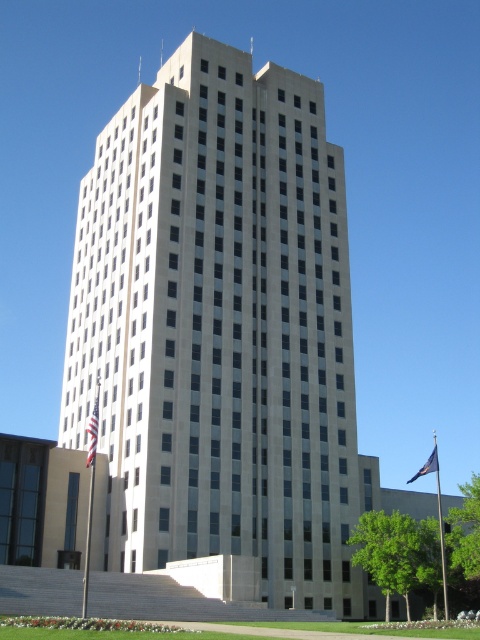
Question: Which is farther from the blue fabric flag at lower right?

Choices:
 (A) metallic flag pole at left
 (B) metallic flag pole at lower right
 (C) american flag at left
 (D) beige concrete tower at center

Answer: (C)

Question: Which point is closer to the camera?

Choices:
 (A) (95, 467)
 (B) (93, 444)
 (C) (148, 104)

Answer: (B)

Question: Does beige concrete tower at center appear on the left side of american flag at left?

Choices:
 (A) yes
 (B) no

Answer: (B)

Question: Is metallic flag pole at lower right above blue fabric flag at lower right?

Choices:
 (A) yes
 (B) no

Answer: (A)

Question: Is metallic flag pole at left to the left of blue fabric flag at lower right from the viewer's perspective?

Choices:
 (A) no
 (B) yes

Answer: (B)

Question: Which of these objects is positioned farthest from the beige concrete tower at center?

Choices:
 (A) american flag at left
 (B) blue fabric flag at lower right

Answer: (B)